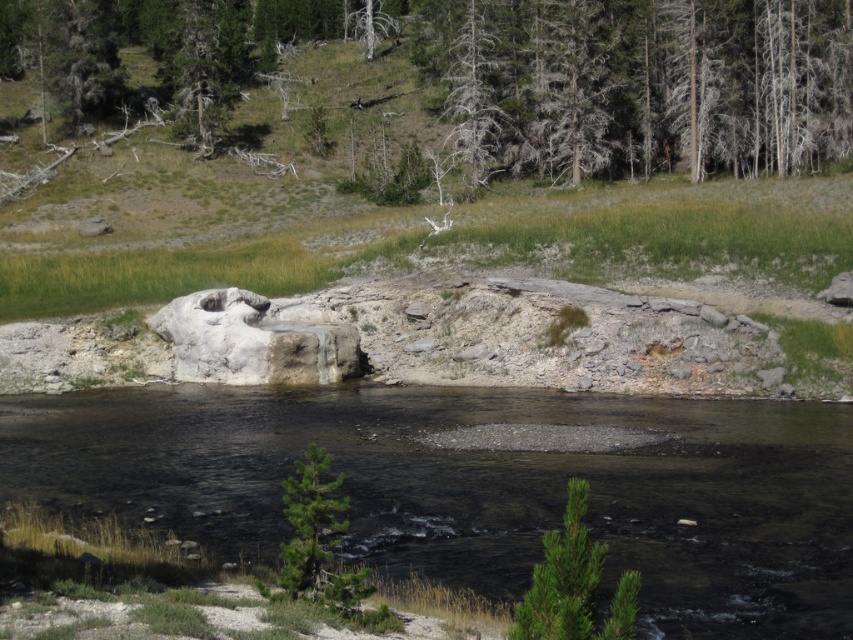
Question: Is dead wood at upper center to the left of green matte tree at lower right from the viewer's perspective?

Choices:
 (A) yes
 (B) no

Answer: (A)

Question: Which is nearer to the clear water at center?

Choices:
 (A) green matte tree at lower center
 (B) gray textured tree at upper center
 (C) dead wood at upper center
 (D) green matte tree at lower right

Answer: (A)

Question: Does clear water at center appear under gray textured tree at upper center?

Choices:
 (A) no
 (B) yes

Answer: (B)

Question: Considering the relative positions of dead wood at upper center and green matte tree at lower center in the image provided, where is dead wood at upper center located with respect to green matte tree at lower center?

Choices:
 (A) below
 (B) above

Answer: (B)

Question: Among these points, which one is farthest from the camera?

Choices:
 (A) (479, 88)
 (B) (4, 484)

Answer: (A)

Question: Which of the following is the farthest from the observer?

Choices:
 (A) (473, 124)
 (B) (811, 634)
 (C) (531, 612)
 (D) (648, 176)

Answer: (D)